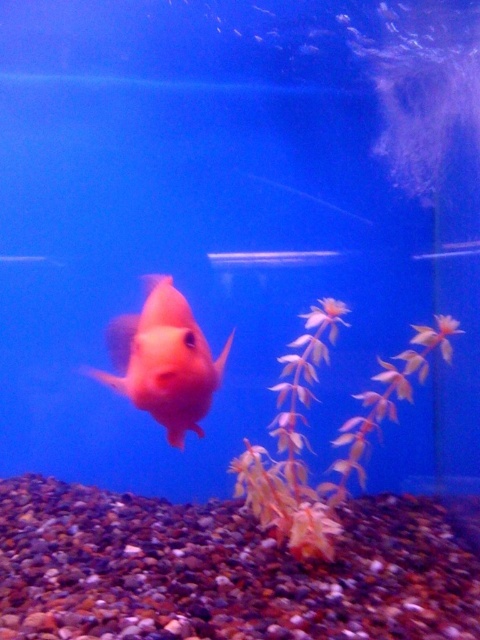
You are an underwater photographer aiming to capture the matte orange fish at center and the yellow matte plant at center in the same frame. Based on their sizes, which one should you focus on to ensure both fit clearly in the photo?

The yellow matte plant at center is bigger than the matte orange fish at center, so you should focus on the yellow matte plant at center to ensure both fit clearly in the photo.

What are the coordinates of the yellow matte plant at center?

The yellow matte plant at center is located at point (332,442).